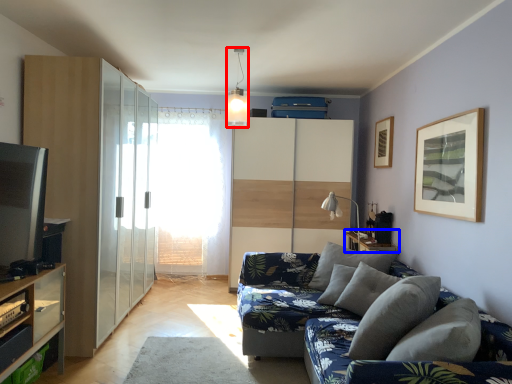
Question: Among these objects, which one is farthest to the camera, light fixture (highlighted by a red box) or table (highlighted by a blue box)?

Choices:
 (A) light fixture
 (B) table

Answer: (B)